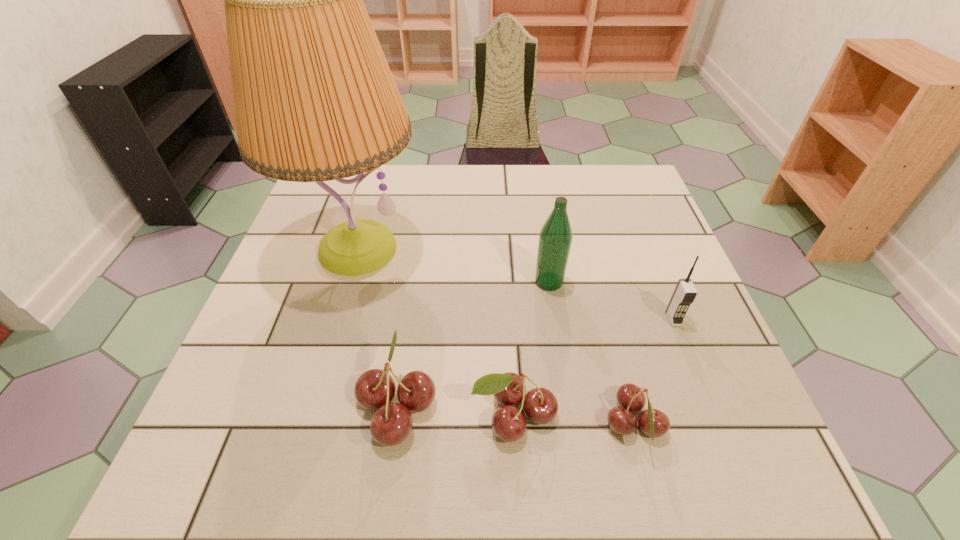
I want to click on object positioned at the far left corner, so click(314, 98).

Where is `object located at the near right corner`? The height and width of the screenshot is (540, 960). object located at the near right corner is located at coordinates (654, 423).

This screenshot has width=960, height=540. Identify the location of free location at the far edge of the desktop. pos(390,166).

Identify the location of vacant space at the near edge of the desktop. (610, 399).

Locate an element on the screen. The image size is (960, 540). vacant region at the left edge of the desktop is located at coordinates click(281, 346).

In the image, there is a desktop. Where is `free space at the right edge`? The height and width of the screenshot is (540, 960). free space at the right edge is located at coordinates (657, 342).

In the image, there is a desktop. Where is `vacant area at the near left corner`? Image resolution: width=960 pixels, height=540 pixels. vacant area at the near left corner is located at coordinates (279, 418).

The width and height of the screenshot is (960, 540). Identify the location of vacant space at the far right corner. (610, 192).

The height and width of the screenshot is (540, 960). Find the location of `free space between the second tallest object and the shortest cherry`. free space between the second tallest object and the shortest cherry is located at coordinates (591, 353).

In order to click on empty space that is in between the lamp and the fourth shortest object in this screenshot , I will do [x=516, y=284].